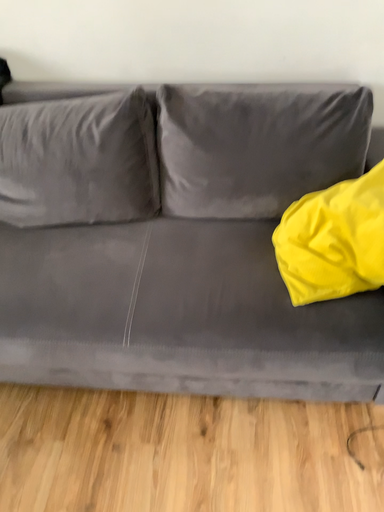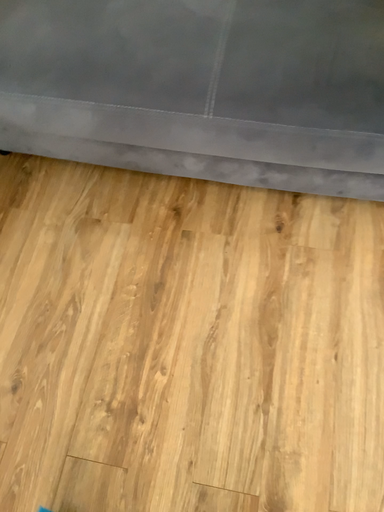
Question: How did the camera likely rotate when shooting the video?

Choices:
 (A) rotated upward
 (B) rotated downward

Answer: (B)